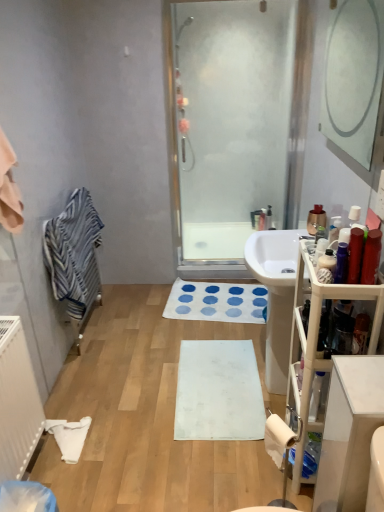
Question: Does white plastic vanity at right have a greater height compared to matte silver faucet at center?

Choices:
 (A) yes
 (B) no

Answer: (A)

Question: From a real-world perspective, is white plastic vanity at right on matte silver faucet at center?

Choices:
 (A) no
 (B) yes

Answer: (B)

Question: Does white plastic vanity at right have a larger size compared to matte silver faucet at center?

Choices:
 (A) yes
 (B) no

Answer: (A)

Question: Is white plastic vanity at right to the right of matte silver faucet at center from the viewer's perspective?

Choices:
 (A) no
 (B) yes

Answer: (A)

Question: Can you confirm if white plastic vanity at right is wider than matte silver faucet at center?

Choices:
 (A) yes
 (B) no

Answer: (A)

Question: Choose the correct answer: Is white glossy sink at center inside white fabric bath mat at center, the second bath mat in the bottom-to-top sequence, or outside it?

Choices:
 (A) outside
 (B) inside

Answer: (A)

Question: Considering the positions of white glossy sink at center and white fabric bath mat at center, acting as the 1th bath mat starting from the top, in the image, is white glossy sink at center wider or thinner than white fabric bath mat at center, acting as the 1th bath mat starting from the top,?

Choices:
 (A) wide
 (B) thin

Answer: (B)

Question: In the image, is white glossy sink at center on the left side or the right side of white fabric bath mat at center, arranged as the first bath mat when viewed from the back?

Choices:
 (A) left
 (B) right

Answer: (B)

Question: Is white glossy sink at center bigger or smaller than white fabric bath mat at center, which appears as the second bath mat when viewed from the front?

Choices:
 (A) big
 (B) small

Answer: (A)

Question: In terms of height, does shiny red bottle at right, the 3th toiletry when ordered from right to left, look taller or shorter compared to transparent glass shower door at center?

Choices:
 (A) short
 (B) tall

Answer: (A)

Question: In the image, is shiny red bottle at right, acting as the 3th toiletry starting from the left, positioned in front of or behind transparent glass shower door at center?

Choices:
 (A) behind
 (B) front

Answer: (B)

Question: Choose the correct answer: Is shiny red bottle at right, the 3th toiletry when ordered from right to left, inside transparent glass shower door at center or outside it?

Choices:
 (A) outside
 (B) inside

Answer: (A)

Question: From a real-world perspective, relative to transparent glass shower door at center, is shiny red bottle at right, which ranks as the second toiletry in front-to-back order, vertically above or below?

Choices:
 (A) below
 (B) above

Answer: (B)

Question: From their relative heights in the image, would you say blue striped towel at left is taller or shorter than white glossy sink at center?

Choices:
 (A) tall
 (B) short

Answer: (B)

Question: Would you say blue striped towel at left is to the left or to the right of white glossy sink at center in the picture?

Choices:
 (A) left
 (B) right

Answer: (A)